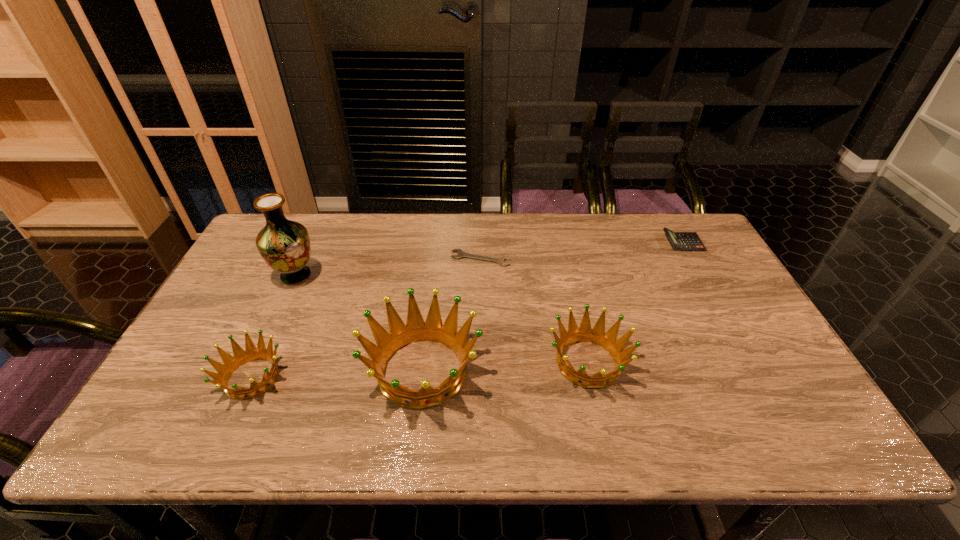
Where is `vacant point located between the leftmost crown and the wrench`? The width and height of the screenshot is (960, 540). vacant point located between the leftmost crown and the wrench is located at coordinates (366, 318).

Image resolution: width=960 pixels, height=540 pixels. I want to click on free spot between the fourth shortest object and the third shortest object, so click(x=420, y=370).

At what (x,y) coordinates should I click in order to perform the action: click on free space between the fifth tallest object and the fifth shortest object. Please return your answer as a coordinate pair (x, y). Looking at the image, I should click on (553, 306).

Locate an element on the screen. This screenshot has height=540, width=960. vacant area that lies between the rightmost crown and the second tallest object is located at coordinates (505, 366).

The width and height of the screenshot is (960, 540). I want to click on vacant area between the second shortest crown and the tallest object, so click(x=442, y=319).

Select which object is the fourth closest to the leftmost crown. Please provide its 2D coordinates. Your answer should be formatted as a tuple, i.e. [(x, y)], where the tuple contains the x and y coordinates of a point satisfying the conditions above.

[(596, 335)]

Select which object appears as the closest to the third tallest object. Please provide its 2D coordinates. Your answer should be formatted as a tuple, i.e. [(x, y)], where the tuple contains the x and y coordinates of a point satisfying the conditions above.

[(416, 330)]

You are a GUI agent. You are given a task and a screenshot of the screen. Output one action in this format:
    pyautogui.click(x=<x>, y=<y>)
    Task: Click on the crown object that ranks as the third closest to the fifth tallest object
    This screenshot has width=960, height=540.
    Given the screenshot: What is the action you would take?
    pyautogui.click(x=251, y=353)

Locate which crown ranks second in proximity to the calculator. Please provide its 2D coordinates. Your answer should be formatted as a tuple, i.e. [(x, y)], where the tuple contains the x and y coordinates of a point satisfying the conditions above.

[(416, 330)]

The width and height of the screenshot is (960, 540). What are the coordinates of `vacant space that satisfies the following two spatial constraints: 1. on the back side of the shortest object; 2. on the right side of the vase` in the screenshot? It's located at (304, 258).